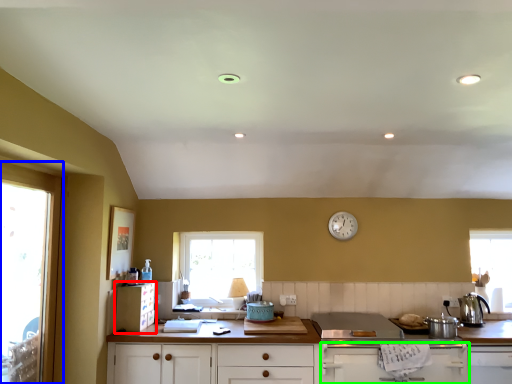
Question: Based on their relative distances, which object is farther from cabinetry (highlighted by a red box)? Choose from window (highlighted by a blue box) and cabinetry (highlighted by a green box).

Choices:
 (A) window
 (B) cabinetry

Answer: (B)